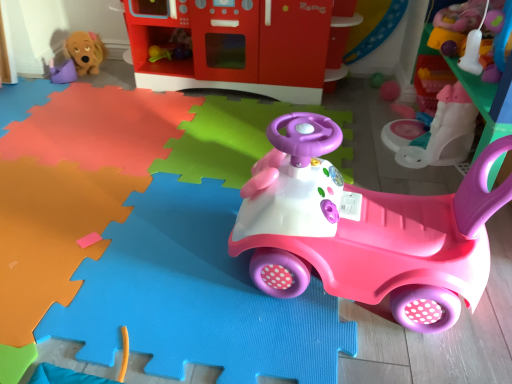
Question: Should I look upward or downward to see pink plastic walker at upper right, the second toy positioned from the right?

Choices:
 (A) down
 (B) up

Answer: (B)

Question: Considering the relative sizes of matte plastic play kitchen at upper center, which ranks as the third toy in left-to-right order, and pink plastic walker at upper right, the second toy positioned from the right, in the image provided, is matte plastic play kitchen at upper center, which ranks as the third toy in left-to-right order, thinner than pink plastic walker at upper right, the second toy positioned from the right,?

Choices:
 (A) no
 (B) yes

Answer: (B)

Question: Is matte plastic play kitchen at upper center, which ranks as the third toy in left-to-right order, closer to camera compared to pink plastic walker at upper right, the second toy positioned from the right?

Choices:
 (A) yes
 (B) no

Answer: (B)

Question: Is matte plastic play kitchen at upper center, which ranks as the third toy in left-to-right order, taller than pink plastic walker at upper right, the second toy positioned from the right?

Choices:
 (A) yes
 (B) no

Answer: (A)

Question: From a real-world perspective, is matte plastic play kitchen at upper center, which is the 4th toy from right to left, beneath pink plastic walker at upper right, the second toy positioned from the right?

Choices:
 (A) yes
 (B) no

Answer: (B)

Question: Is pink plastic walker at upper right, which is counted as the fifth toy, starting from the left, completely or partially inside matte plastic play kitchen at upper center, which is the 4th toy from right to left?

Choices:
 (A) yes
 (B) no

Answer: (B)

Question: Is matte plastic play kitchen at upper center, which is the 4th toy from right to left, oriented towards pink plastic walker at upper right, which is counted as the fifth toy, starting from the left?

Choices:
 (A) no
 (B) yes

Answer: (A)

Question: From the image's perspective, is pink plastic car at center, which is the fourth toy from left to right, on top of matte purple toy at upper left, the 1th toy when ordered from left to right?

Choices:
 (A) no
 (B) yes

Answer: (A)

Question: Can you confirm if pink plastic car at center, the third toy when ordered from right to left, is shorter than matte purple toy at upper left, which is the sixth toy in right-to-left order?

Choices:
 (A) no
 (B) yes

Answer: (A)

Question: From a real-world perspective, is pink plastic car at center, the third toy when ordered from right to left, beneath matte purple toy at upper left, which is the sixth toy in right-to-left order?

Choices:
 (A) yes
 (B) no

Answer: (B)

Question: Can you confirm if pink plastic car at center, the third toy when ordered from right to left, is taller than matte purple toy at upper left, which is the sixth toy in right-to-left order?

Choices:
 (A) no
 (B) yes

Answer: (B)

Question: Can you confirm if pink plastic car at center, which is the fourth toy from left to right, is bigger than matte purple toy at upper left, the 1th toy when ordered from left to right?

Choices:
 (A) yes
 (B) no

Answer: (A)

Question: Is pink plastic car at center, which is the fourth toy from left to right, smaller than matte purple toy at upper left, the 1th toy when ordered from left to right?

Choices:
 (A) yes
 (B) no

Answer: (B)

Question: Considering the relative positions of smooth plastic toy at upper right, placed as the first toy when sorted from right to left, and pink plastic walker at upper right, the second toy positioned from the right, in the image provided, is smooth plastic toy at upper right, placed as the first toy when sorted from right to left, behind pink plastic walker at upper right, the second toy positioned from the right,?

Choices:
 (A) no
 (B) yes

Answer: (A)